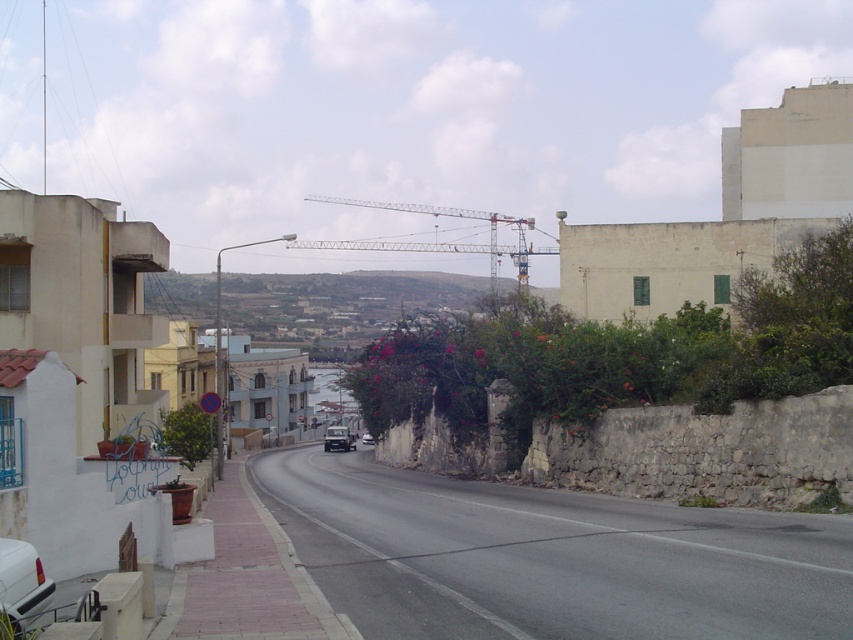
You are a delivery driver trying to navigate a narrow alley that is only 3 meters wide. You see the metallic gray crane at center and the white matte car at lower left in the image. Can both the crane and the car fit side by side in the alley without touching each other?

The metallic gray crane at center might be wider than white matte car at lower left. Since the alley is only 3 meters wide, there is a possibility that the combined width of both the crane and the car exceeds the alley width, so they might not fit side by side without touching.

You are a delivery driver who needs to park your matte black car at center in a spot that is exactly at point 0.5, 0.5. Can you park there?

The matte black car at center is currently at point (338, 438), so it cannot be parked at the desired point (426, 320).

You are a delivery driver who needs to turn the corner on the road bordered by the stone wall on the right and the sidewalk with potted plants on the left. Your truck is 2.5 meters wide. Can you safely navigate the turn without hitting the metallic gray crane at center or the matte black car at center?

The metallic gray crane at center might be wider than the matte black car at center. Since the crane could be wider than the truck, there is a risk of collision. To ensure safety, the driver should check the exact width of the crane before attempting the turn.